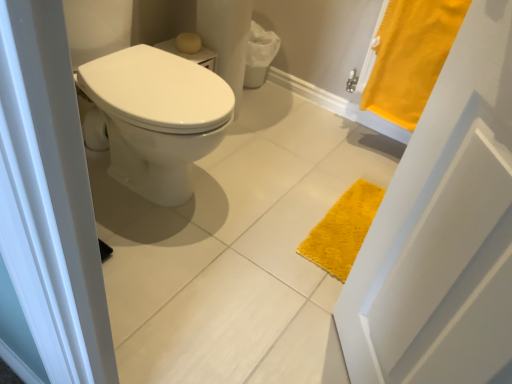
Describe the element at coordinates (188, 43) in the screenshot. I see `matte yellow soap at upper center` at that location.

The height and width of the screenshot is (384, 512). I want to click on matte yellow soap at upper center, so click(x=188, y=43).

The width and height of the screenshot is (512, 384). Describe the element at coordinates (411, 57) in the screenshot. I see `yellow fabric bath towel at upper right` at that location.

In order to face yellow fabric bath towel at upper right, should I rotate leftwards or rightwards?

To align with it, rotate right about 21.164°.

The image size is (512, 384). I want to click on yellow fabric bath towel at upper right, so click(x=411, y=57).

Find the location of a particular element. This screenshot has width=512, height=384. matte yellow soap at upper center is located at coordinates (188, 43).

Is matte yellow soap at upper center to the left of yellow fabric bath towel at upper right from the viewer's perspective?

Correct, you'll find matte yellow soap at upper center to the left of yellow fabric bath towel at upper right.

Is the position of matte yellow soap at upper center less distant than that of yellow fabric bath towel at upper right?

No, it is behind yellow fabric bath towel at upper right.

Which is in front, point (185, 36) or point (390, 45)?

The point (390, 45) is more forward.

From the image's perspective, is matte yellow soap at upper center located above or below yellow fabric bath towel at upper right?

From the image's perspective, matte yellow soap at upper center appears above yellow fabric bath towel at upper right.

From a real-world perspective, is matte yellow soap at upper center beneath yellow fabric bath towel at upper right?

Yes, from a real-world perspective, matte yellow soap at upper center is below yellow fabric bath towel at upper right.

Which object is wider, matte yellow soap at upper center or yellow fabric bath towel at upper right?

With larger width is yellow fabric bath towel at upper right.

Which of these two, matte yellow soap at upper center or yellow fabric bath towel at upper right, stands shorter?

matte yellow soap at upper center.

Looking at the image, does matte yellow soap at upper center seem bigger or smaller compared to yellow fabric bath towel at upper right?

matte yellow soap at upper center is smaller than yellow fabric bath towel at upper right.

Is matte yellow soap at upper center completely or partially outside of yellow fabric bath towel at upper right?

Yes, matte yellow soap at upper center is not within yellow fabric bath towel at upper right.

Is matte yellow soap at upper center placed right next to yellow fabric bath towel at upper right?

matte yellow soap at upper center and yellow fabric bath towel at upper right are clearly separated.

Is matte yellow soap at upper center facing away from yellow fabric bath towel at upper right?

matte yellow soap at upper center does not have its back to yellow fabric bath towel at upper right.

I want to click on bath towel in front of the matte yellow soap at upper center, so click(x=411, y=57).

Considering the positions of objects yellow fabric bath towel at upper right and matte yellow soap at upper center in the image provided, who is more to the right, yellow fabric bath towel at upper right or matte yellow soap at upper center?

From the viewer's perspective, yellow fabric bath towel at upper right appears more on the right side.

In the image, is yellow fabric bath towel at upper right positioned in front of or behind matte yellow soap at upper center?

Clearly, yellow fabric bath towel at upper right is in front of matte yellow soap at upper center.

Which is behind, point (436, 38) or point (198, 46)?

Positioned behind is point (198, 46).

From the image's perspective, does yellow fabric bath towel at upper right appear higher than matte yellow soap at upper center?

No, from the image's perspective, yellow fabric bath towel at upper right is not above matte yellow soap at upper center.

From a real-world perspective, is yellow fabric bath towel at upper right physically below matte yellow soap at upper center?

No, from a real-world perspective, yellow fabric bath towel at upper right is not under matte yellow soap at upper center.

Can you confirm if yellow fabric bath towel at upper right is wider than matte yellow soap at upper center?

Yes.

Is yellow fabric bath towel at upper right shorter than matte yellow soap at upper center?

Incorrect, the height of yellow fabric bath towel at upper right does not fall short of that of matte yellow soap at upper center.

Which of these two, yellow fabric bath towel at upper right or matte yellow soap at upper center, is smaller?

matte yellow soap at upper center.

Would you say matte yellow soap at upper center is part of yellow fabric bath towel at upper right's contents?

No, yellow fabric bath towel at upper right does not contain matte yellow soap at upper center.

Is yellow fabric bath towel at upper right not near matte yellow soap at upper center?

No, there isn't a large distance between yellow fabric bath towel at upper right and matte yellow soap at upper center.

Could you tell me if yellow fabric bath towel at upper right is turned towards matte yellow soap at upper center?

No, yellow fabric bath towel at upper right is not facing towards matte yellow soap at upper center.

Can you tell me how much yellow fabric bath towel at upper right and matte yellow soap at upper center differ in facing direction?

The facing directions of yellow fabric bath towel at upper right and matte yellow soap at upper center are 88.6 degrees apart.

How much distance is there between yellow fabric bath towel at upper right and matte yellow soap at upper center?

The distance of yellow fabric bath towel at upper right from matte yellow soap at upper center is 32.22 inches.

Identify the location of bath towel lying on the right of matte yellow soap at upper center. This screenshot has width=512, height=384. point(411,57).

I want to click on soap behind the yellow fabric bath towel at upper right, so click(x=188, y=43).

In order to click on bath towel below the matte yellow soap at upper center (from the image's perspective) in this screenshot , I will do `click(411, 57)`.